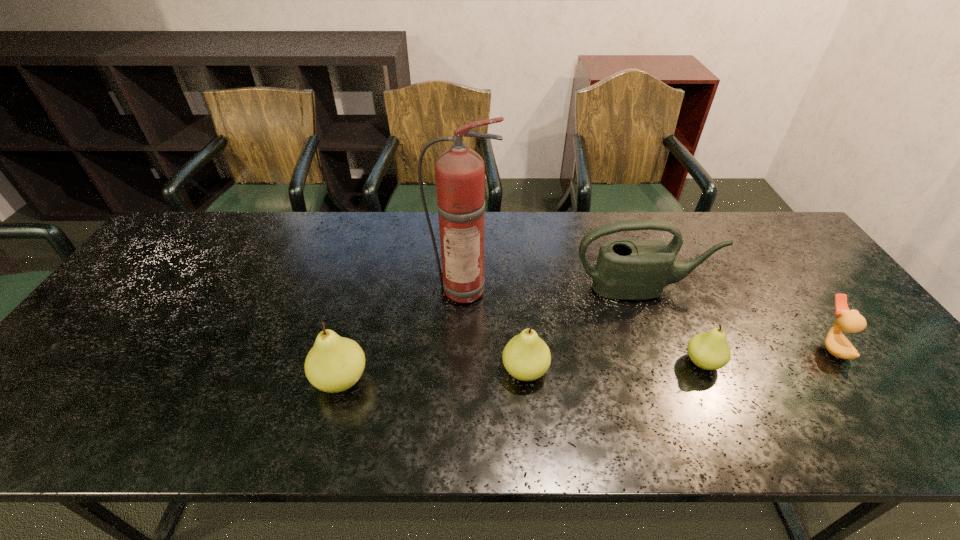
The image size is (960, 540). What are the coordinates of `vacant space situated 0.220m on the right of the shortest pear` in the screenshot? It's located at (813, 362).

Locate an element on the screen. The image size is (960, 540). vacant space positioned on the spout of the fifth shortest object is located at coordinates (672, 372).

You are a GUI agent. You are given a task and a screenshot of the screen. Output one action in this format:
    pyautogui.click(x=<x>, y=<y>)
    Task: Click on the vacant space situated 0.210m on the side of the tallest object with the label and nozzle
    
    Given the screenshot: What is the action you would take?
    pyautogui.click(x=461, y=370)

This screenshot has width=960, height=540. What are the coordinates of `free location located 0.330m on the beak of the rightmost object` in the screenshot? It's located at (686, 347).

Image resolution: width=960 pixels, height=540 pixels. I want to click on vacant region located 0.150m on the beak of the rightmost object, so click(x=759, y=347).

In order to click on blank space located 0.380m on the beak of the rightmost object in this screenshot , I will do `click(666, 347)`.

Identify the location of object at the right edge. The width and height of the screenshot is (960, 540). (850, 321).

I want to click on free spot at the far edge of the desktop, so click(x=543, y=254).

In order to click on vacant space at the near edge of the desktop in this screenshot , I will do `click(387, 380)`.

Image resolution: width=960 pixels, height=540 pixels. Identify the location of vacant space at the far left corner. (204, 217).